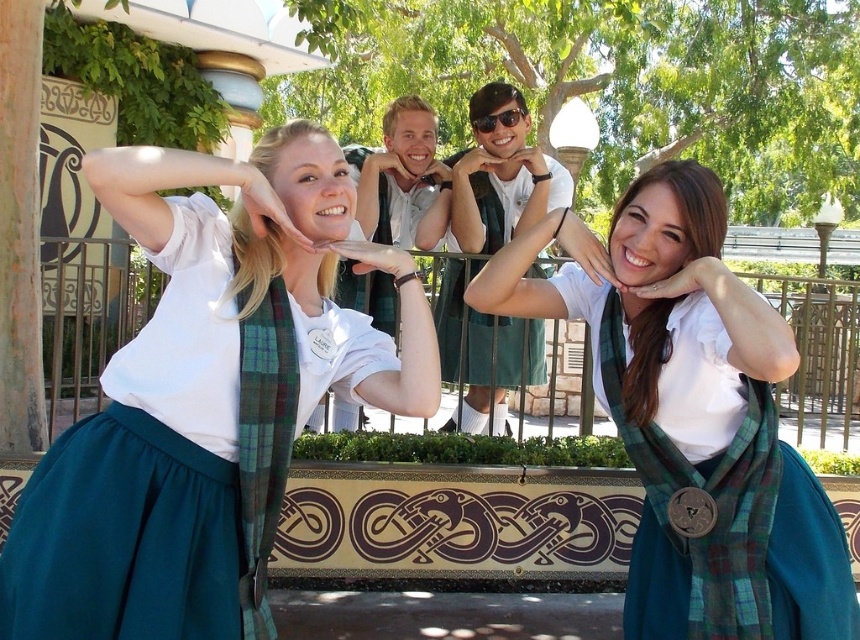
You are a costume designer preparing for a play and need to ensure that the green plaid scarf at center and the white cotton shirt at center are arranged properly. Based on the scene, which item is shorter in length?

The green plaid scarf at center is shorter than the white cotton shirt at center.

You are a photographer trying to capture the plaid fabric scarf at center in the image. The camera is set to focus on the point at coordinates point (691,416). Will the plaid fabric scarf at center be in focus?

The point (691,416) marks the plaid fabric scarf at center, so yes, the plaid fabric scarf at center will be in focus at that point.